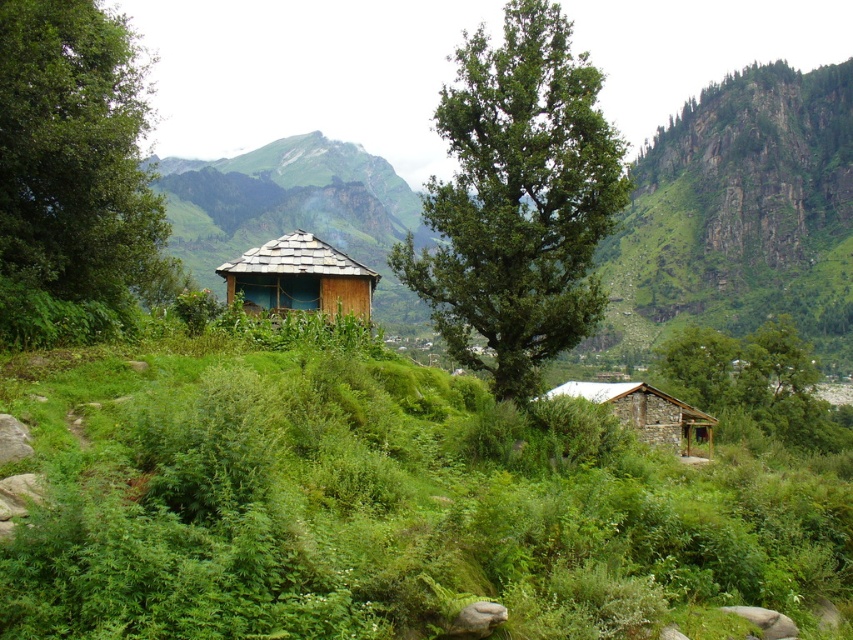
You are a hiker who wants to take a photo of the wooden thatched hut at center without the green leafy tree at lower right blocking the view. Which direction should you move to ensure the tree is no longer in front of the hut?

The green leafy tree at lower right is closer to you than the wooden thatched hut at center. To avoid the tree blocking the view of the hut, move to the left or right so the tree is no longer between you and the hut.

You are standing in the middle of the rural landscape and want to walk towards the green leafy tree at left. Which direction should you move relative to the green leafy tree at center?

You should move to the left of the green leafy tree at center to reach the green leafy tree at left since the green leafy tree at center is located to the right of the green leafy tree at left.